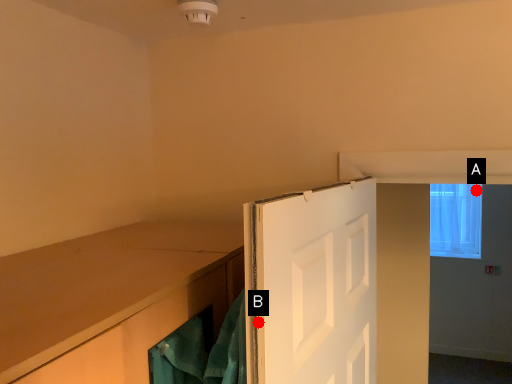
Question: Two points are circled on the image, labeled by A and B beside each circle. Which point is closer to the camera?

Choices:
 (A) A is closer
 (B) B is closer

Answer: (B)